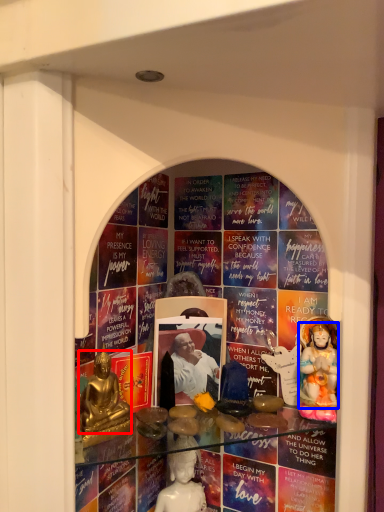
Question: Among these objects, which one is farthest to the camera, person (highlighted by a red box) or person (highlighted by a blue box)?

Choices:
 (A) person
 (B) person

Answer: (B)